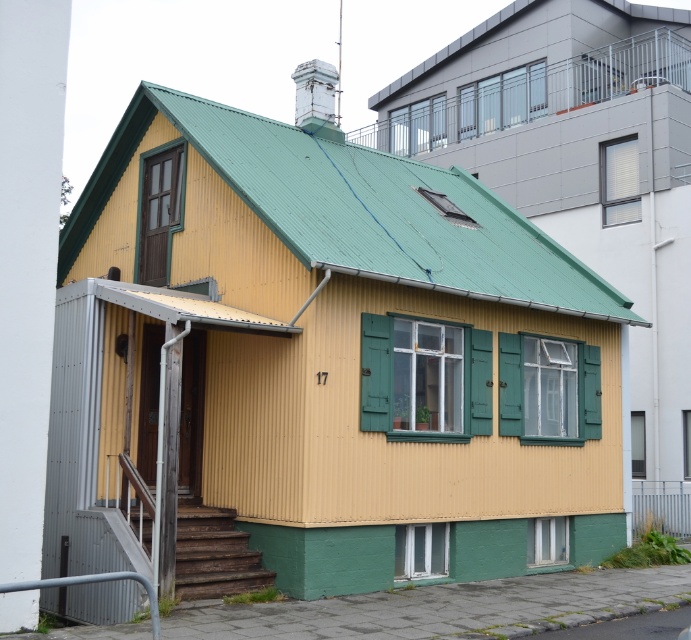
You are a painter who needs to reach both the green wood door at upper left and the green wooden shutter at upper right to paint them. You have a ladder that is 12 meters long. Can you safely reach both objects with your ladder?

The distance between the green wood door at upper left and the green wooden shutter at upper right is 13.38 meters. Since the ladder is only 12 meters long, it is not long enough to span the distance between them. Therefore, you cannot safely reach both objects with your current ladder.

You are a painter who needs to decide which item requires more paint between the green wood door at upper left and the green wooden shutter at upper right. Based on their sizes, which one would need more paint?

The green wood door at upper left requires more paint because its width is larger than the green wooden shutter at upper right.